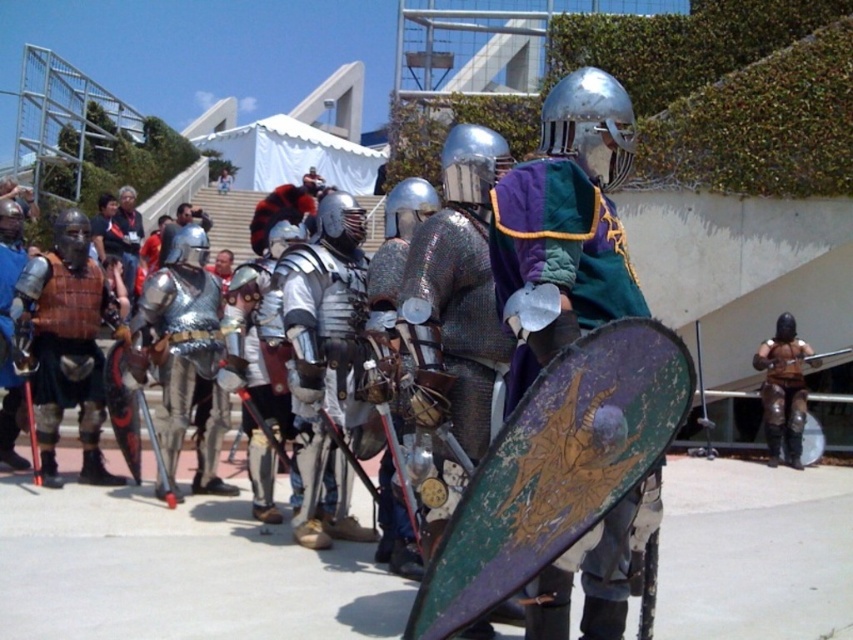
You are standing in the middle of the medieval reenactment field. There are two points marked in the image, point A at coordinates point (549, 156) and point B at coordinates point (798, 385). Which point is closer to you?

Point A at coordinates point (549, 156) is closer to the viewer than point B at coordinates point (798, 385).

From the picture: You are a photographer at the historical event and want to capture a clear photo of both the shiny silver helmet at center and the brown leather armor at right. Since you can only focus on one object at a time, which one should you focus on first to ensure it appears sharp in the photo?

The shiny silver helmet at center is in front of the brown leather armor at right, so focusing on the shiny silver helmet at center first will ensure it appears sharp while the brown leather armor at right may be slightly blurred. Alternatively, focusing on the shiny silver helmet at center and using a smaller aperture can keep both in focus.

You are a photographer trying to capture a shot of the shiny silver helmet at center and the brown leather armor at right. If you want to frame both in your camera viewfinder, which object should you adjust your focus on first to ensure both are in the same frame?

Since the shiny silver helmet at center is to the left of brown leather armor at right, you should adjust your focus on the shiny silver helmet at center first to ensure both are in the same frame.